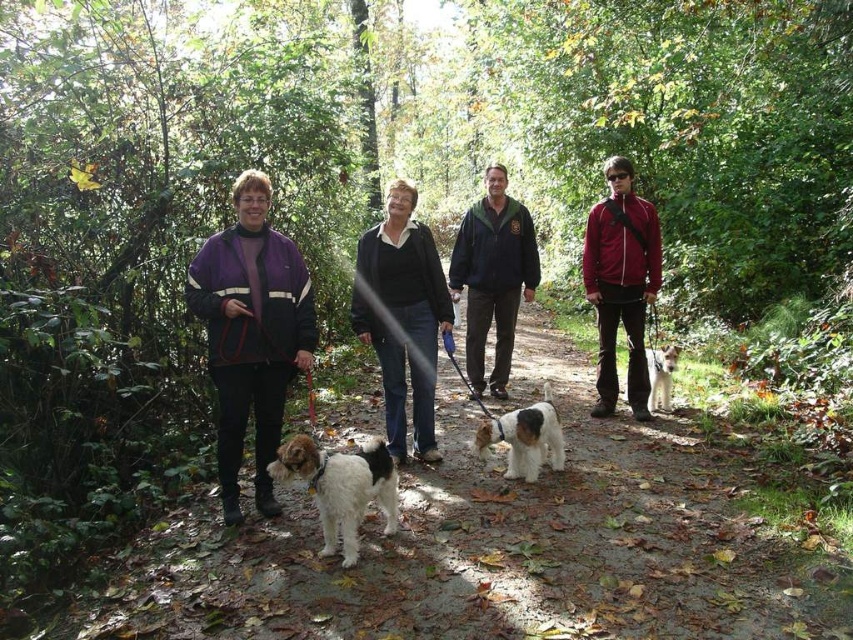
What are the coordinates of `black sweater at center` in the screenshot? It's located at (402, 316).

Does black sweater at center appear on the right side of white textured dog at center?

Incorrect, black sweater at center is not on the right side of white textured dog at center.

Who is more forward, (403, 337) or (515, 458)?

Point (515, 458) is in front.

Find the location of a particular element. The width and height of the screenshot is (853, 640). black sweater at center is located at coordinates (402, 316).

Measure the distance between point (519, 243) and camera.

Point (519, 243) is 7.13 meters away from camera.

What do you see at coordinates (492, 276) in the screenshot?
I see `green textured jacket at center` at bounding box center [492, 276].

Where is `green textured jacket at center`? The width and height of the screenshot is (853, 640). green textured jacket at center is located at coordinates (492, 276).

How far apart are white textured dog at center and white fur at center?

They are 1.89 meters apart.

Does white textured dog at center have a lesser height compared to white fur at center?

No.

Does point (544, 445) come behind point (648, 412)?

No, (544, 445) is closer to viewer.

At what (x,y) coordinates should I click in order to perform the action: click on white textured dog at center. Please return your answer as a coordinate pair (x, y). The width and height of the screenshot is (853, 640). Looking at the image, I should click on (524, 436).